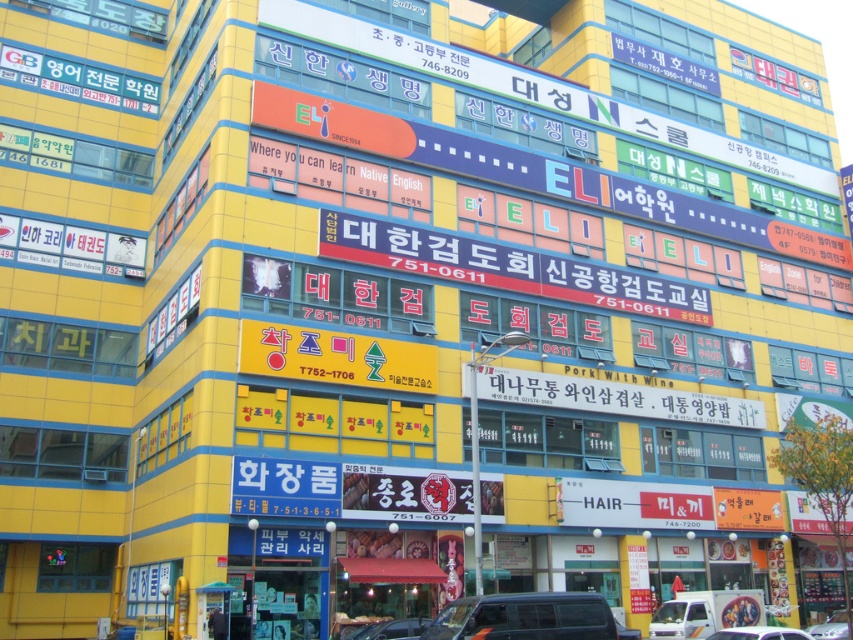
Question: Can you confirm if dark gray metallic van at center is positioned above white matte car at lower center?

Choices:
 (A) no
 (B) yes

Answer: (B)

Question: Among these objects, which one is farthest from the camera?

Choices:
 (A) white matte car at lower center
 (B) dark gray metallic van at center
 (C) metallic silver car at center

Answer: (C)

Question: Is dark gray metallic van at center below white matte car at lower center?

Choices:
 (A) yes
 (B) no

Answer: (B)

Question: Based on their relative distances, which object is farther from the white matte car at lower center?

Choices:
 (A) shiny silver car at center
 (B) dark gray metallic van at center

Answer: (B)

Question: Is dark gray metallic van at center bigger than metallic silver car at center?

Choices:
 (A) yes
 (B) no

Answer: (A)

Question: Which point is closer to the camera?

Choices:
 (A) shiny silver car at center
 (B) dark gray metallic van at center
 (C) white matte car at lower center
 (D) metallic silver car at center

Answer: (C)